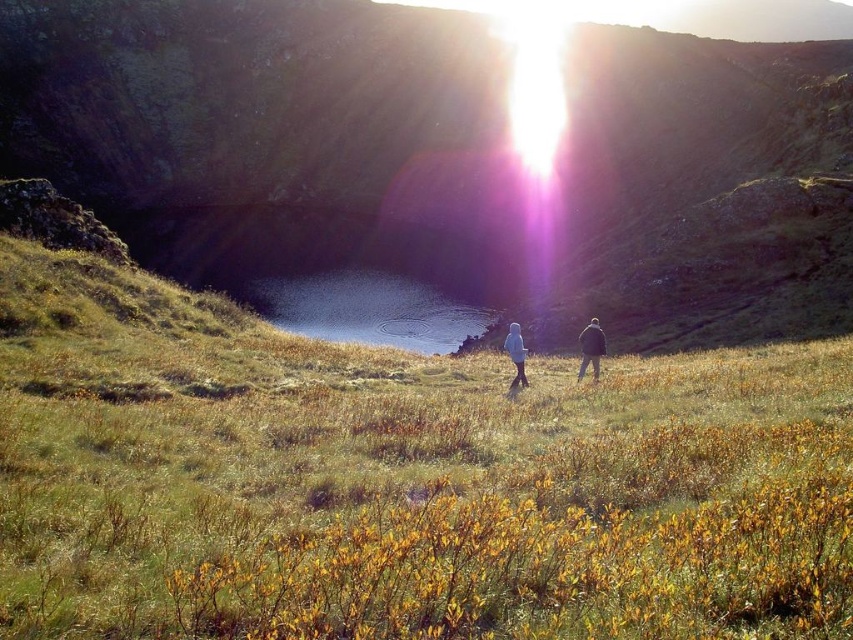
You are standing in the middle of the green grassy hillside at center and want to walk to the smooth reflective water at center. Which direction should you head towards?

The smooth reflective water at center is narrower than the green grassy hillside at center, so you should head towards the center where the water is located.

You are planning to set up a tent for a camping trip and have two options for locations in the image. One is on the green grassy hillside at center and the other is on the smooth reflective water at center. Based on the scene description, which location would be more suitable for setting up your tent?

The green grassy hillside at center is more suitable for setting up a tent because it has a larger size compared to the smooth reflective water at center, providing a stable and spacious area for camping.